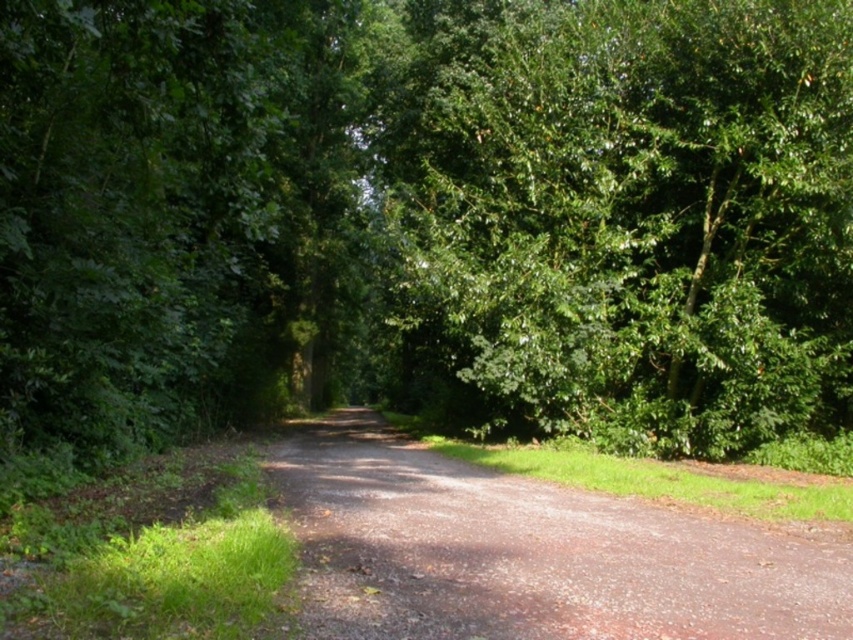
Question: Which object appears farthest from the camera in this image?

Choices:
 (A) dirt/gravel path at center
 (B) green leafy tree at center

Answer: (B)

Question: Is green leafy tree at center to the left of dirt/gravel path at center from the viewer's perspective?

Choices:
 (A) no
 (B) yes

Answer: (A)

Question: Does green leafy tree at center appear over dirt/gravel path at center?

Choices:
 (A) no
 (B) yes

Answer: (B)

Question: Can you confirm if green leafy tree at center is smaller than dirt/gravel path at center?

Choices:
 (A) no
 (B) yes

Answer: (A)